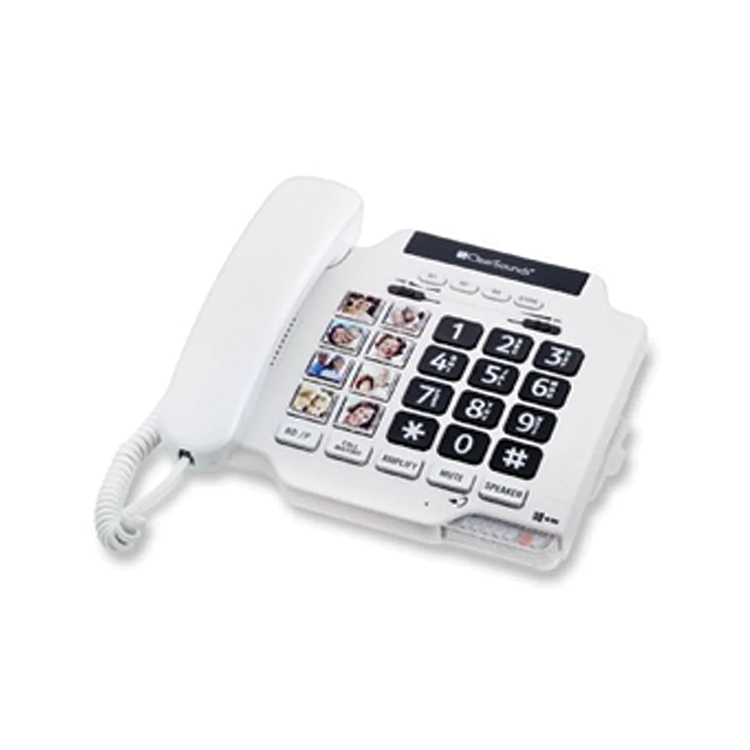
The image size is (750, 750). I want to click on switch, so click(411, 290), click(538, 324).